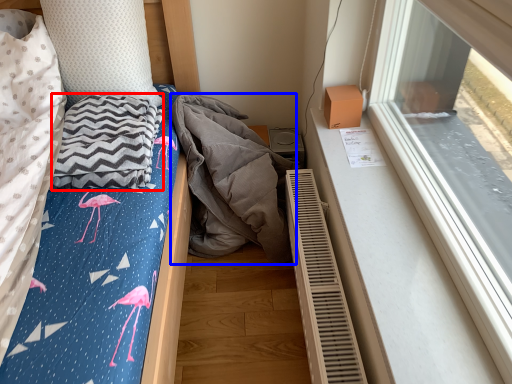
Question: Which of the following is the closest to the observer, blanket (highlighted by a red box) or material (highlighted by a blue box)?

Choices:
 (A) blanket
 (B) material

Answer: (A)